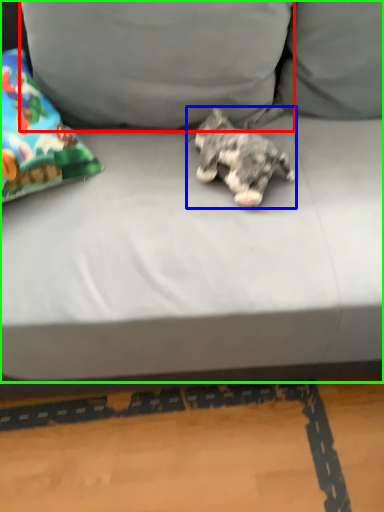
Question: Which object is positioned farthest from pillow (highlighted by a red box)? Select from dog (highlighted by a blue box) and studio couch (highlighted by a green box).

Choices:
 (A) dog
 (B) studio couch

Answer: (A)